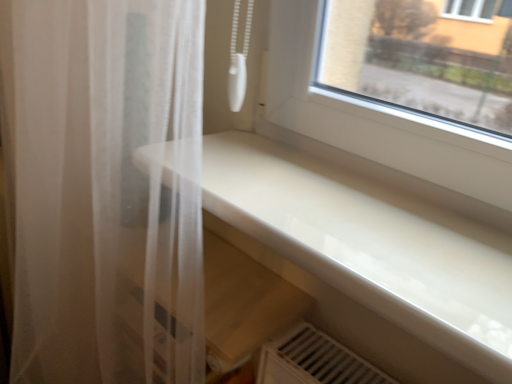
Question: Is translucent white curtain at left shorter than white glossy counter top at center?

Choices:
 (A) yes
 (B) no

Answer: (B)

Question: From the image's perspective, is translucent white curtain at left under white glossy counter top at center?

Choices:
 (A) yes
 (B) no

Answer: (A)

Question: Is translucent white curtain at left wider than white glossy counter top at center?

Choices:
 (A) yes
 (B) no

Answer: (B)

Question: From a real-world perspective, is translucent white curtain at left on white glossy counter top at center?

Choices:
 (A) yes
 (B) no

Answer: (B)

Question: Would you say translucent white curtain at left contains white glossy counter top at center?

Choices:
 (A) yes
 (B) no

Answer: (B)

Question: From a real-world perspective, is translucent white curtain at left located beneath white glossy counter top at center?

Choices:
 (A) no
 (B) yes

Answer: (B)

Question: Is white glossy counter top at center closer to the viewer compared to translucent white curtain at left?

Choices:
 (A) yes
 (B) no

Answer: (A)

Question: From the image's perspective, does white glossy counter top at center appear higher than translucent white curtain at left?

Choices:
 (A) no
 (B) yes

Answer: (B)

Question: Considering the relative positions of white glossy counter top at center and translucent white curtain at left in the image provided, is white glossy counter top at center to the right of translucent white curtain at left from the viewer's perspective?

Choices:
 (A) no
 (B) yes

Answer: (B)

Question: Could you tell me if white glossy counter top at center is facing translucent white curtain at left?

Choices:
 (A) yes
 (B) no

Answer: (B)

Question: Is white glossy counter top at center bigger than translucent white curtain at left?

Choices:
 (A) yes
 (B) no

Answer: (B)

Question: From the image's perspective, is white glossy counter top at center under translucent white curtain at left?

Choices:
 (A) no
 (B) yes

Answer: (A)

Question: In terms of size, does white glossy counter top at center appear bigger or smaller than translucent white curtain at left?

Choices:
 (A) small
 (B) big

Answer: (A)